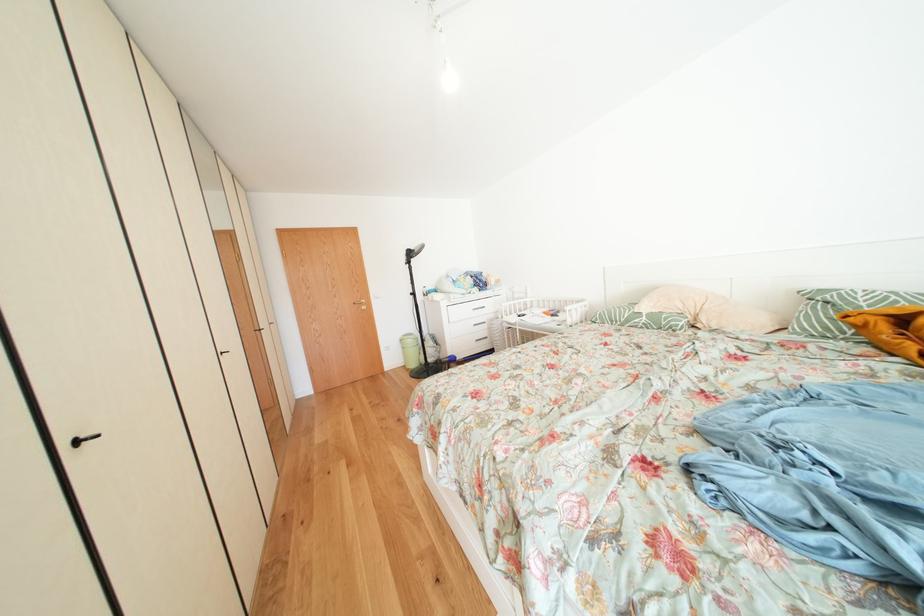
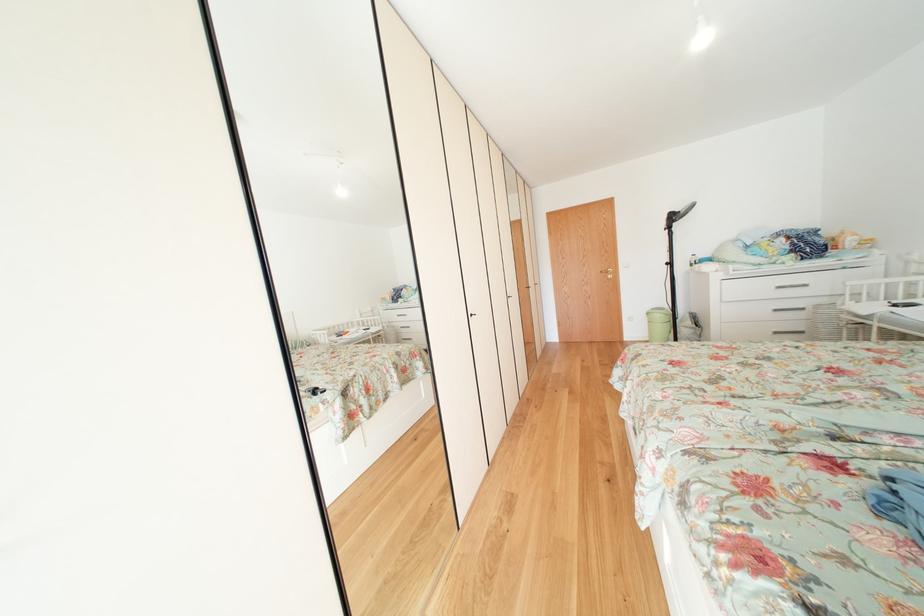
Question: Based on the continuous images, in which direction is the camera rotating? Reply with the corresponding letter.

Choices:
 (A) Left
 (B) Right
 (C) Up
 (D) Down

Answer: (A)